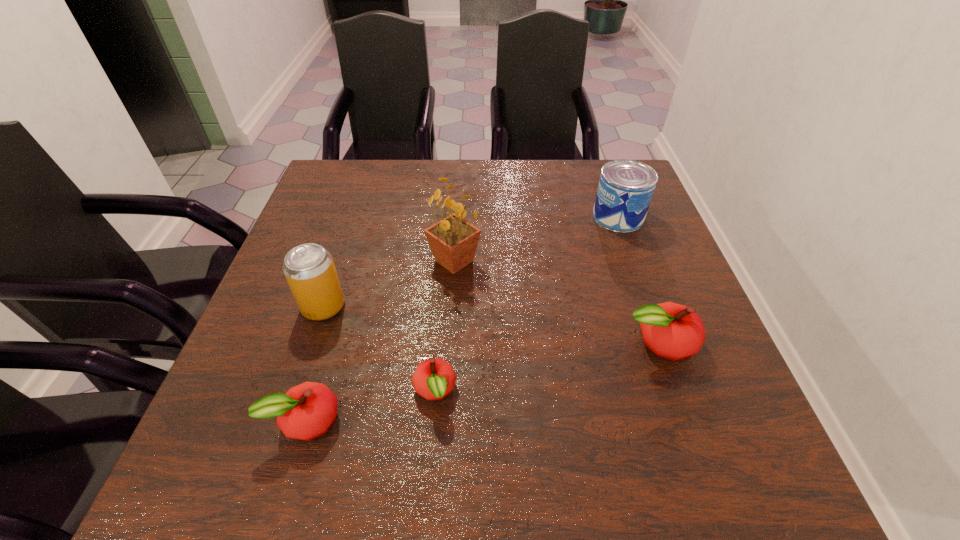
Where is `the second shortest apple`? Image resolution: width=960 pixels, height=540 pixels. the second shortest apple is located at coordinates pyautogui.click(x=306, y=411).

Locate an element on the screen. the leftmost apple is located at coordinates (306, 411).

Locate an element on the screen. This screenshot has height=540, width=960. the shortest object is located at coordinates (434, 378).

Where is `the second apple from left to right`? This screenshot has height=540, width=960. the second apple from left to right is located at coordinates (434, 378).

At what (x,y) coordinates should I click in order to perform the action: click on the rightmost apple. Please return your answer as a coordinate pair (x, y). The image size is (960, 540). Looking at the image, I should click on (673, 331).

The image size is (960, 540). In order to click on the tallest apple in this screenshot , I will do `click(673, 331)`.

Identify the location of the tallest object. The width and height of the screenshot is (960, 540). (453, 241).

The width and height of the screenshot is (960, 540). I want to click on the second farthest object, so click(x=453, y=241).

Where is `pop (soda)`? The image size is (960, 540). pop (soda) is located at coordinates (309, 269).

Image resolution: width=960 pixels, height=540 pixels. What are the coordinates of `can` in the screenshot? It's located at (625, 189).